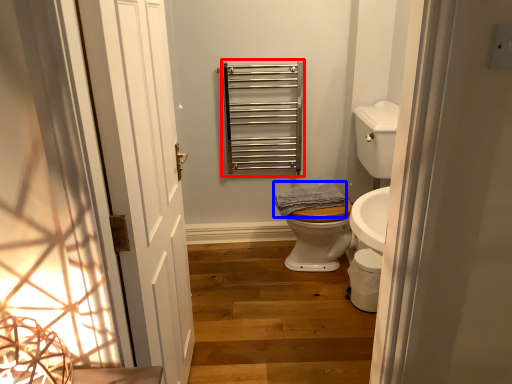
Question: Which point is closer to the camera, balustrade (highlighted by a red box) or material (highlighted by a blue box)?

Choices:
 (A) balustrade
 (B) material

Answer: (B)